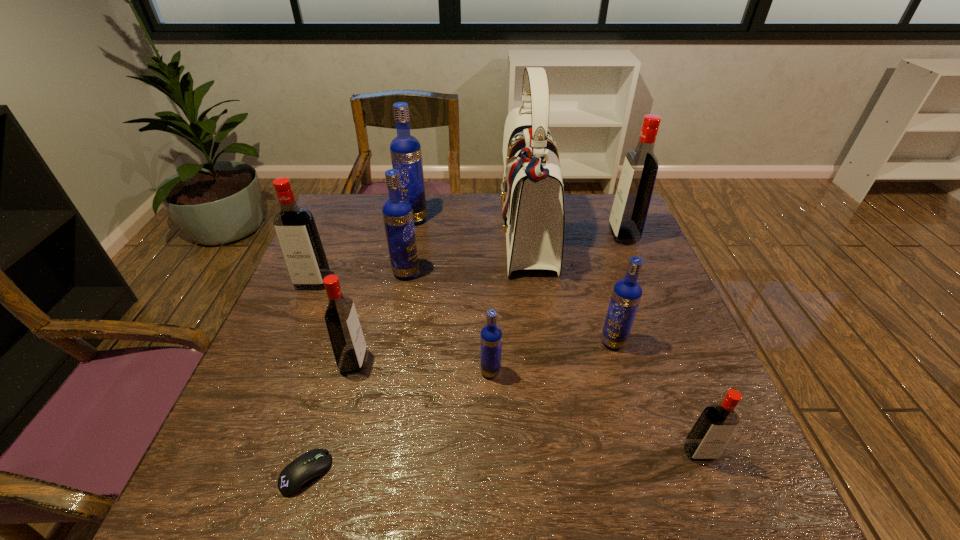
Identify the location of vacant area that lies between the fifth object from right to left and the smallest red vodka. (595, 412).

The width and height of the screenshot is (960, 540). Identify the location of the second closest object relative to the biggest red vodka. (626, 295).

Identify which object is the ninth closest to the farthest red vodka. Please provide its 2D coordinates. Your answer should be formatted as a tuple, i.e. [(x, y)], where the tuple contains the x and y coordinates of a point satisfying the conditions above.

[(295, 477)]

Choose which vodka is the nearest neighbor to the sixth object from left to right. Please provide its 2D coordinates. Your answer should be formatted as a tuple, i.e. [(x, y)], where the tuple contains the x and y coordinates of a point satisfying the conditions above.

[(626, 295)]

Locate an element on the screen. This screenshot has height=540, width=960. vodka object that ranks as the second closest to the black computer equipment is located at coordinates (491, 335).

The height and width of the screenshot is (540, 960). Find the location of `red vodka that can be found as the third closest to the farthest red vodka`. red vodka that can be found as the third closest to the farthest red vodka is located at coordinates (295, 227).

At what (x,y) coordinates should I click in order to perform the action: click on red vodka object that ranks as the second closest to the farthest blue vodka. Please return your answer as a coordinate pair (x, y). Looking at the image, I should click on (349, 347).

Locate an element on the screen. the third closest blue vodka relative to the farthest blue vodka is located at coordinates (626, 295).

Find the location of `blue vodka that is the fourth closest to the shortest object`. blue vodka that is the fourth closest to the shortest object is located at coordinates (406, 156).

Identify the location of blank area in the image that satisfies the following two spatial constraints: 1. on the front and back of the biggest red vodka; 2. on the front and back of the nearest red vodka. This screenshot has width=960, height=540. (714, 452).